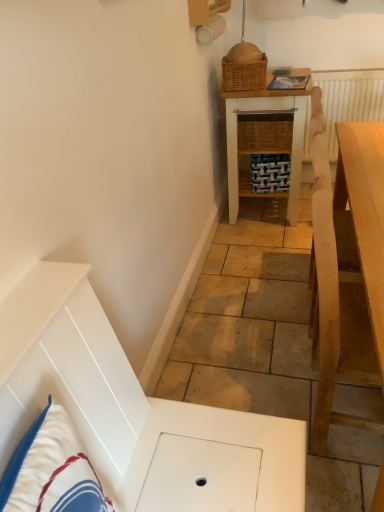
You are a GUI agent. You are given a task and a screenshot of the screen. Output one action in this format:
    pyautogui.click(x=<x>, y=<y>)
    Task: Click on the vacant point to the left of light wood table at right, the second table positioned from the back
    This screenshot has height=512, width=384.
    Given the screenshot: What is the action you would take?
    pyautogui.click(x=250, y=387)